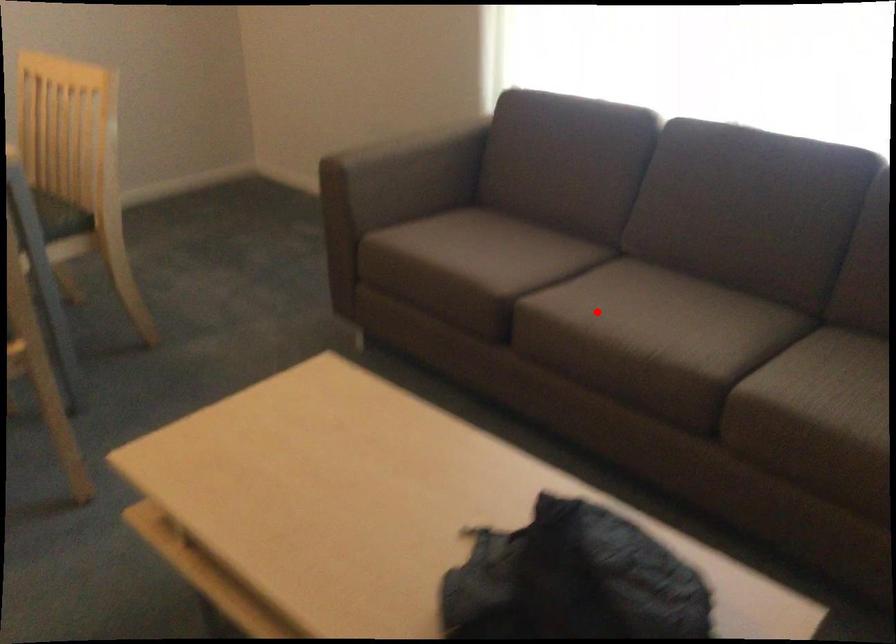
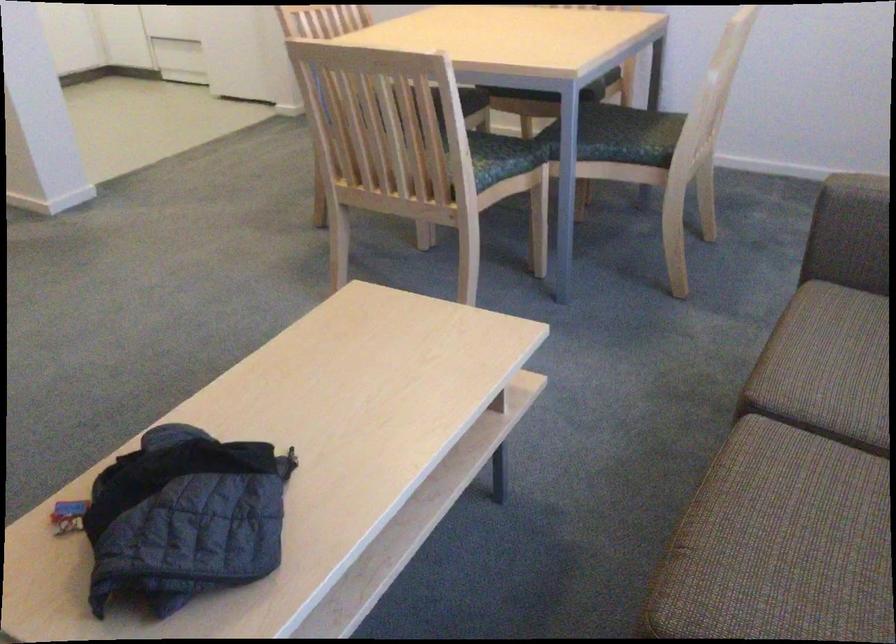
Find the pixel in the second image that matches the highlighted location in the first image.

(794, 489)